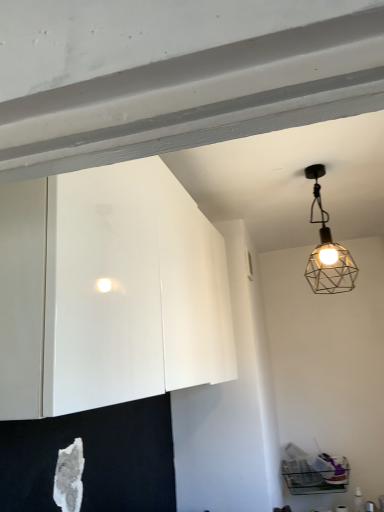
Question: Based on their positions, is metallic wireframe lamp at upper right located to the left or right of white glossy cabinet at upper left?

Choices:
 (A) right
 (B) left

Answer: (A)

Question: From a real-world perspective, is metallic wireframe lamp at upper right above or below white glossy cabinet at upper left?

Choices:
 (A) below
 (B) above

Answer: (B)

Question: In terms of height, does metallic wireframe lamp at upper right look taller or shorter compared to white glossy cabinet at upper left?

Choices:
 (A) tall
 (B) short

Answer: (B)

Question: Looking at the image, does white glossy cabinet at upper left seem bigger or smaller compared to metallic wireframe lamp at upper right?

Choices:
 (A) big
 (B) small

Answer: (A)

Question: From a real-world perspective, is white glossy cabinet at upper left positioned above or below metallic wireframe lamp at upper right?

Choices:
 (A) above
 (B) below

Answer: (B)

Question: Is point (8, 325) closer or farther from the camera than point (306, 275)?

Choices:
 (A) closer
 (B) farther

Answer: (A)

Question: From their relative heights in the image, would you say white glossy cabinet at upper left is taller or shorter than metallic wireframe lamp at upper right?

Choices:
 (A) tall
 (B) short

Answer: (A)